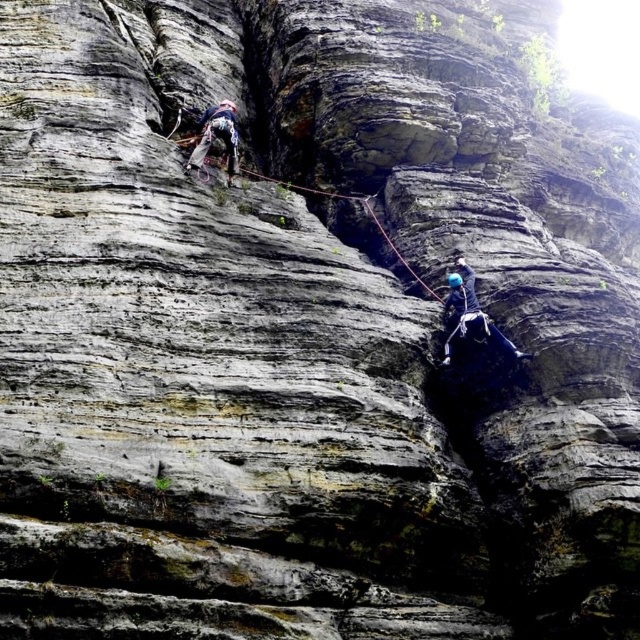
You are a climber assessing the safety setup. You notice the blue fabric climbing harness at upper left and the red nylon rope at center. Which object is positioned higher on the cliff face?

The blue fabric climbing harness at upper left is located above the red nylon rope at center, so it is positioned higher on the cliff face.

You are a rock climber preparing to secure your gear. You have a blue fabric climbing harness at upper left and a red nylon rope at center. Which of these two items is narrower in width?

The blue fabric climbing harness at upper left has a lesser width compared to the red nylon rope at center, so the blue fabric climbing harness at upper left is narrower.